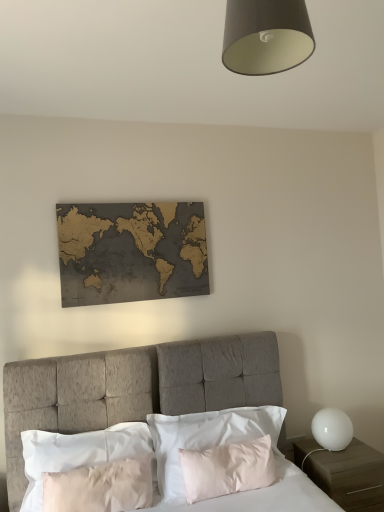
Image resolution: width=384 pixels, height=512 pixels. I want to click on free spot below gold-toned wood world map at upper center (from a real-world perspective), so click(x=141, y=346).